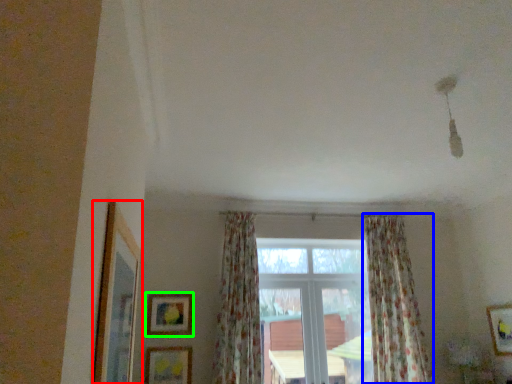
Question: Estimate the real-world distances between objects in this image. Which object is closer to picture frame (highlighted by a red box), curtain (highlighted by a blue box) or picture frame (highlighted by a green box)?

Choices:
 (A) curtain
 (B) picture frame

Answer: (B)